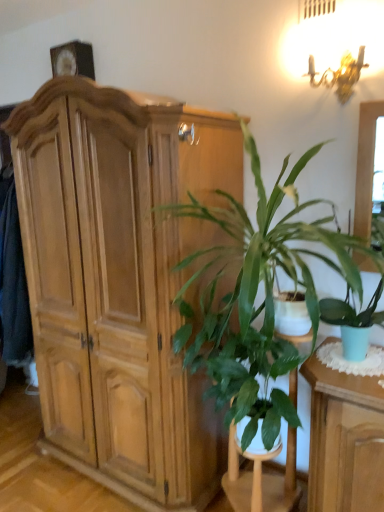
Question: From the image's perspective, does green glossy plant at center appear lower than green leafy plant at center?

Choices:
 (A) yes
 (B) no

Answer: (B)

Question: Are green glossy plant at center and green leafy plant at center located far from each other?

Choices:
 (A) yes
 (B) no

Answer: (B)

Question: Is green glossy plant at center wider than green leafy plant at center?

Choices:
 (A) no
 (B) yes

Answer: (B)

Question: Can you confirm if green glossy plant at center is positioned to the left of green leafy plant at center?

Choices:
 (A) yes
 (B) no

Answer: (B)

Question: Does green glossy plant at center come behind green leafy plant at center?

Choices:
 (A) no
 (B) yes

Answer: (A)

Question: Would you say green glossy plant at center is outside green leafy plant at center?

Choices:
 (A) no
 (B) yes

Answer: (B)

Question: Is green leafy plant at center to the right of green glossy plant at center from the viewer's perspective?

Choices:
 (A) no
 (B) yes

Answer: (A)

Question: Does green leafy plant at center have a greater width compared to green glossy plant at center?

Choices:
 (A) no
 (B) yes

Answer: (A)

Question: From a real-world perspective, is green leafy plant at center physically above green glossy plant at center?

Choices:
 (A) yes
 (B) no

Answer: (B)

Question: Is green leafy plant at center oriented away from green glossy plant at center?

Choices:
 (A) no
 (B) yes

Answer: (A)

Question: Is green leafy plant at center further to camera compared to green glossy plant at center?

Choices:
 (A) yes
 (B) no

Answer: (A)

Question: Is green leafy plant at center smaller than green glossy plant at center?

Choices:
 (A) no
 (B) yes

Answer: (B)

Question: From a real-world perspective, is green leafy plant at center over light brown wood cabinet at left?

Choices:
 (A) no
 (B) yes

Answer: (A)